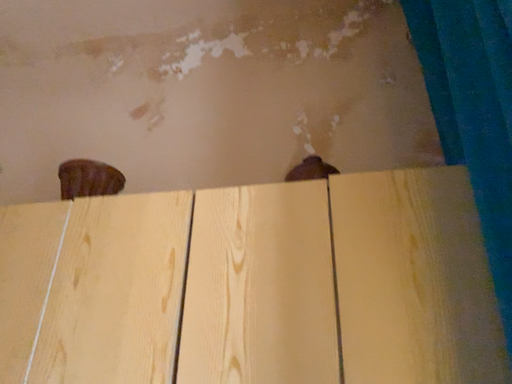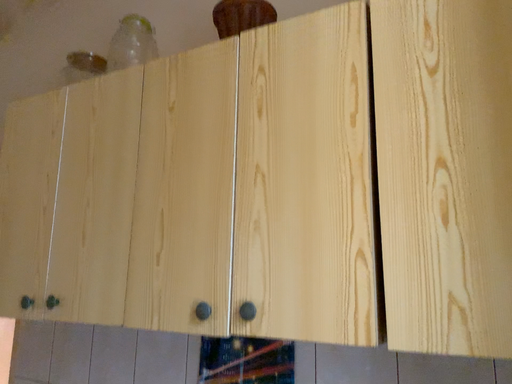
Question: How did the camera likely rotate when shooting the video?

Choices:
 (A) rotated upward
 (B) rotated downward

Answer: (B)